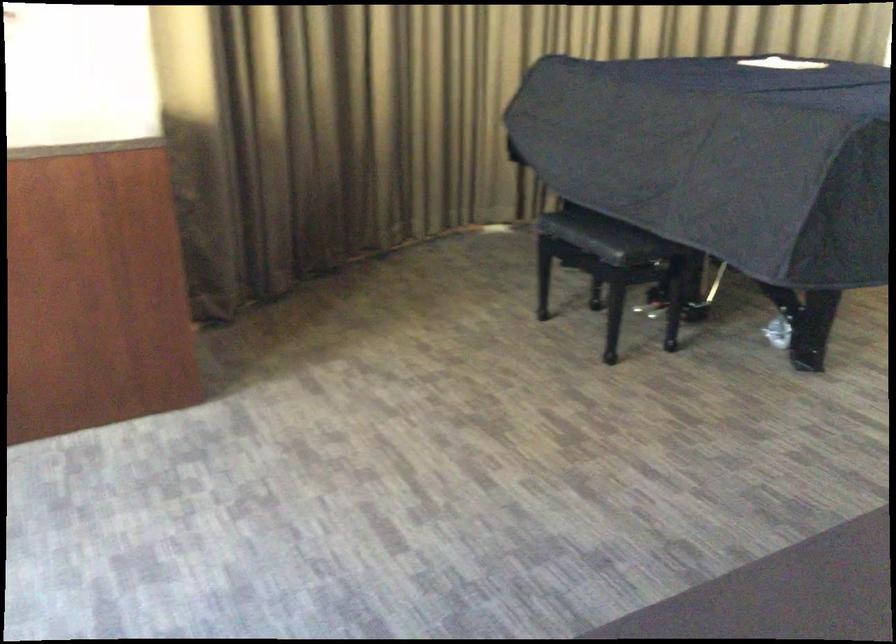
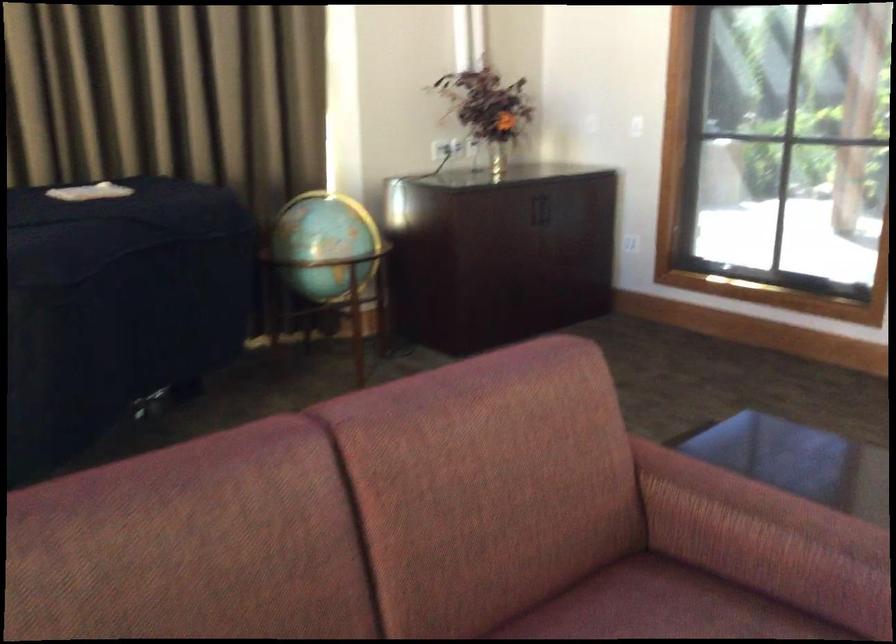
Question: What movement of the cameraman would produce the second image?

Choices:
 (A) Left
 (B) Right
 (C) Forward
 (D) Backward

Answer: (B)